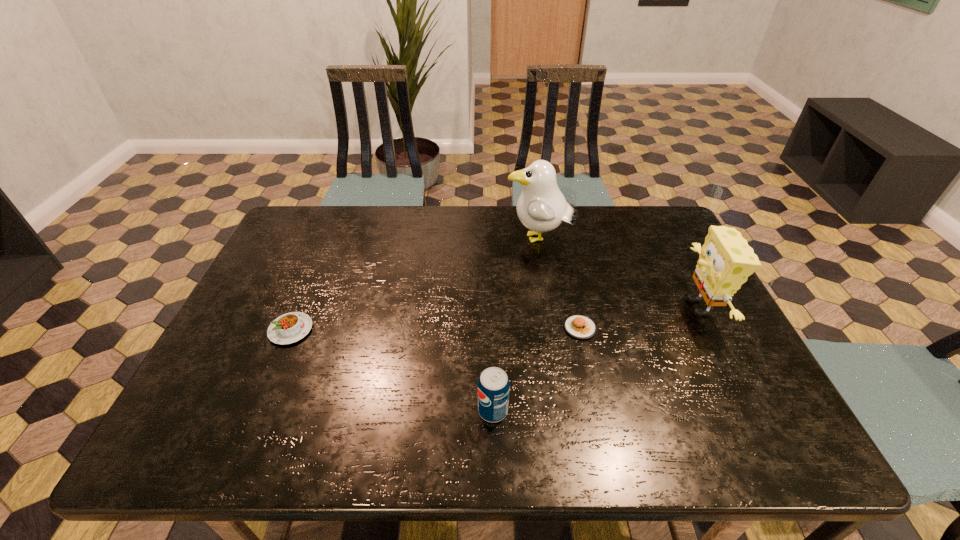
Locate an element on the screen. This screenshot has width=960, height=540. vacant space located 0.080m on the beak of the farthest object is located at coordinates (479, 240).

The height and width of the screenshot is (540, 960). Find the location of `vacant space situated 0.200m on the beak of the farthest object`. vacant space situated 0.200m on the beak of the farthest object is located at coordinates (442, 240).

In order to click on vacant space located 0.310m on the face of the sponge in this screenshot , I will do `click(563, 307)`.

This screenshot has width=960, height=540. I want to click on free location located on the face of the sponge, so click(x=608, y=307).

This screenshot has height=540, width=960. What are the coordinates of `free space located on the face of the sponge` in the screenshot? It's located at (555, 307).

The height and width of the screenshot is (540, 960). What are the coordinates of `free region located 0.100m on the right of the nearest object` in the screenshot? It's located at (555, 410).

The width and height of the screenshot is (960, 540). Find the location of `free region located 0.320m on the right of the pudding`. free region located 0.320m on the right of the pudding is located at coordinates (440, 330).

This screenshot has height=540, width=960. What are the coordinates of `blank space located on the left of the food` in the screenshot? It's located at (509, 328).

Locate an element on the screen. The image size is (960, 540). object at the far edge is located at coordinates (541, 207).

Locate an element on the screen. object that is at the near edge is located at coordinates (493, 385).